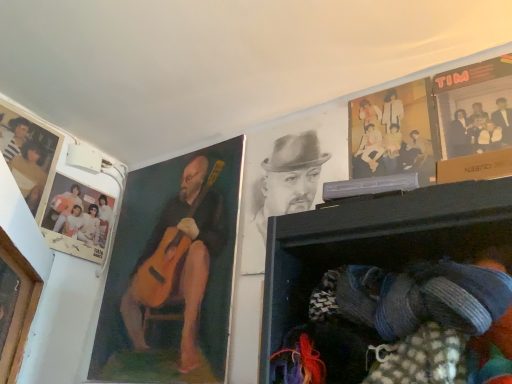
Question: In terms of height, does wooden frame at left look taller or shorter compared to matte plastic picture frame at upper left?

Choices:
 (A) short
 (B) tall

Answer: (B)

Question: Considering the positions of wooden frame at left and matte plastic picture frame at upper left in the image, is wooden frame at left bigger or smaller than matte plastic picture frame at upper left?

Choices:
 (A) small
 (B) big

Answer: (B)

Question: Which object is the closest to the knitted fabric at lower right?

Choices:
 (A) wooden guitar at left, which appears as the first man when viewed from the left
 (B) black paper portrait at upper center, which is the 2th man in left-to-right order
 (C) matte paper poster at upper right, the second poster page positioned from the back
 (D) matte paper photo at upper left, which is the second poster page in right-to-left order
 (E) pastel yellow fabric at upper right

Answer: (C)

Question: Which object is the closest to the matte paper poster at upper right, the 1th poster page in the right-to-left sequence?

Choices:
 (A) matte paper photo at upper left, which is the second poster page in right-to-left order
 (B) wooden frame at left
 (C) wooden guitar at left, the 2th man in the right-to-left sequence
 (D) pastel yellow fabric at upper right
 (E) matte plastic picture frame at upper left

Answer: (D)